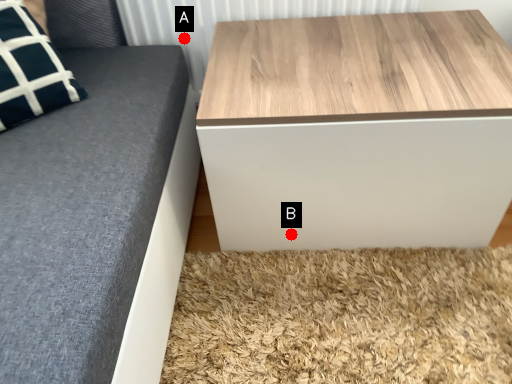
Question: Two points are circled on the image, labeled by A and B beside each circle. Among these points, which one is farthest from the camera?

Choices:
 (A) A is further
 (B) B is further

Answer: (A)